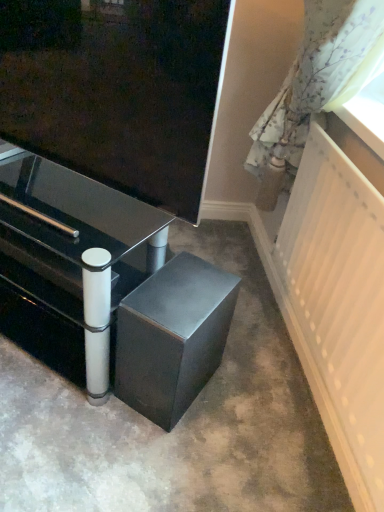
Question: From a real-world perspective, is metallic black table at lower center positioned over white textured radiator at right based on gravity?

Choices:
 (A) no
 (B) yes

Answer: (A)

Question: Can you confirm if metallic black table at lower center is wider than white textured radiator at right?

Choices:
 (A) no
 (B) yes

Answer: (B)

Question: Is white textured radiator at right located within metallic black table at lower center?

Choices:
 (A) no
 (B) yes

Answer: (A)

Question: Does metallic black table at lower center have a larger size compared to white textured radiator at right?

Choices:
 (A) yes
 (B) no

Answer: (A)

Question: Does metallic black table at lower center have a greater height compared to white textured radiator at right?

Choices:
 (A) yes
 (B) no

Answer: (B)

Question: From a real-world perspective, is metallic black table at lower center beneath white textured radiator at right?

Choices:
 (A) no
 (B) yes

Answer: (B)

Question: Is floral fabric curtain at right at the left side of metallic black table at lower center?

Choices:
 (A) no
 (B) yes

Answer: (A)

Question: From a real-world perspective, is floral fabric curtain at right under metallic black table at lower center?

Choices:
 (A) no
 (B) yes

Answer: (A)

Question: Would you say floral fabric curtain at right contains metallic black table at lower center?

Choices:
 (A) no
 (B) yes

Answer: (A)

Question: Is floral fabric curtain at right taller than metallic black table at lower center?

Choices:
 (A) yes
 (B) no

Answer: (B)

Question: Does floral fabric curtain at right have a greater width compared to metallic black table at lower center?

Choices:
 (A) yes
 (B) no

Answer: (B)

Question: Does floral fabric curtain at right turn towards metallic black table at lower center?

Choices:
 (A) no
 (B) yes

Answer: (B)

Question: Does satin black speaker at lower center lie behind white glossy drawer at lower left?

Choices:
 (A) no
 (B) yes

Answer: (A)